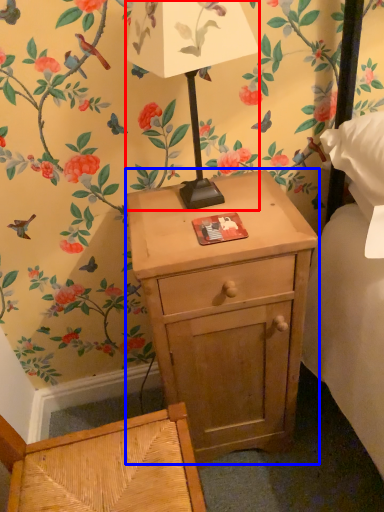
Question: Which of the following is the closest to the observer, table lamp (highlighted by a red box) or nightstand (highlighted by a blue box)?

Choices:
 (A) table lamp
 (B) nightstand

Answer: (A)